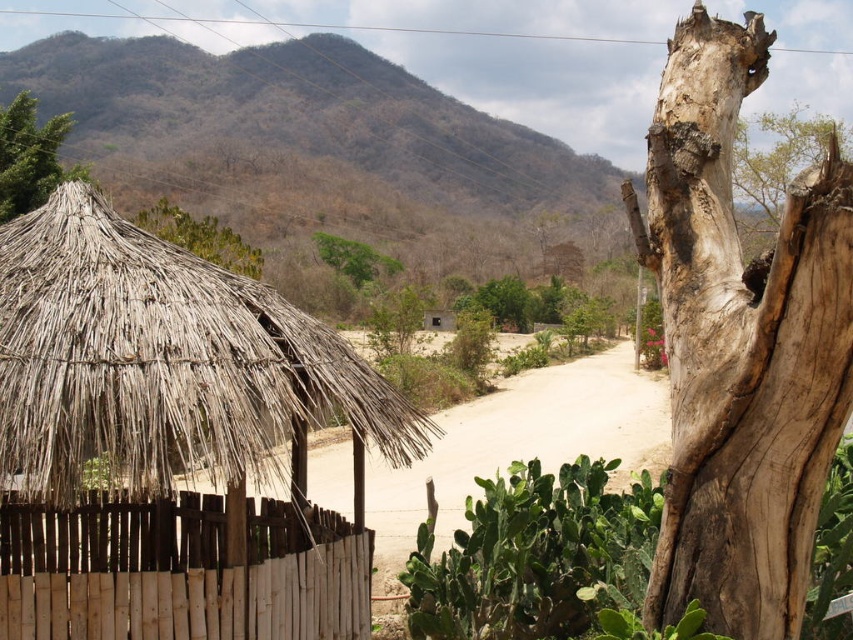
Is thatched straw hut at left below green leafy tree at center?

Yes, thatched straw hut at left is below green leafy tree at center.

Measure the distance from thatched straw hut at left to green leafy tree at center.

The distance of thatched straw hut at left from green leafy tree at center is 181.62 feet.

Between point (109, 429) and point (341, 272), which one is positioned behind?

The point (341, 272) is behind.

The height and width of the screenshot is (640, 853). Find the location of `thatched straw hut at left`. thatched straw hut at left is located at coordinates (171, 440).

Between point (32, 230) and point (67, 627), which one is positioned behind?

Point (32, 230)

Is thatched straw hut at left further to camera compared to brown wooden fence at left?

No, thatched straw hut at left is in front of brown wooden fence at left.

Between point (311, 362) and point (316, 515), which one is positioned in front?

Point (311, 362)

What are the coordinates of `thatched straw hut at left` in the screenshot? It's located at (171, 440).

Is point (782, 390) less distant than point (811, 150)?

Yes, it is in front of point (811, 150).

Image resolution: width=853 pixels, height=640 pixels. I want to click on light brown rough bark at right, so click(740, 346).

Who is more distant from viewer, (675,28) or (840,145)?

The point (840,145) is more distant.

I want to click on light brown rough bark at right, so click(x=740, y=346).